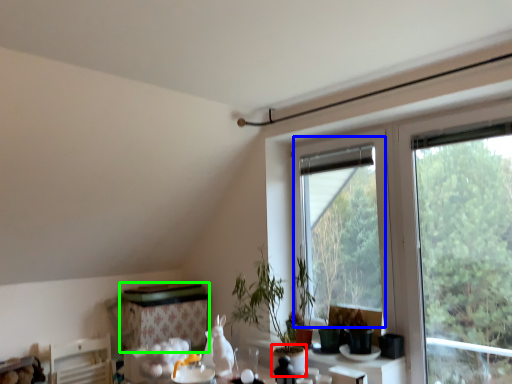
Question: Estimate the real-world distances between objects in this image. Which object is farther from glass vase (highlighted by a red box), bay window (highlighted by a blue box) or table (highlighted by a green box)?

Choices:
 (A) bay window
 (B) table

Answer: (A)